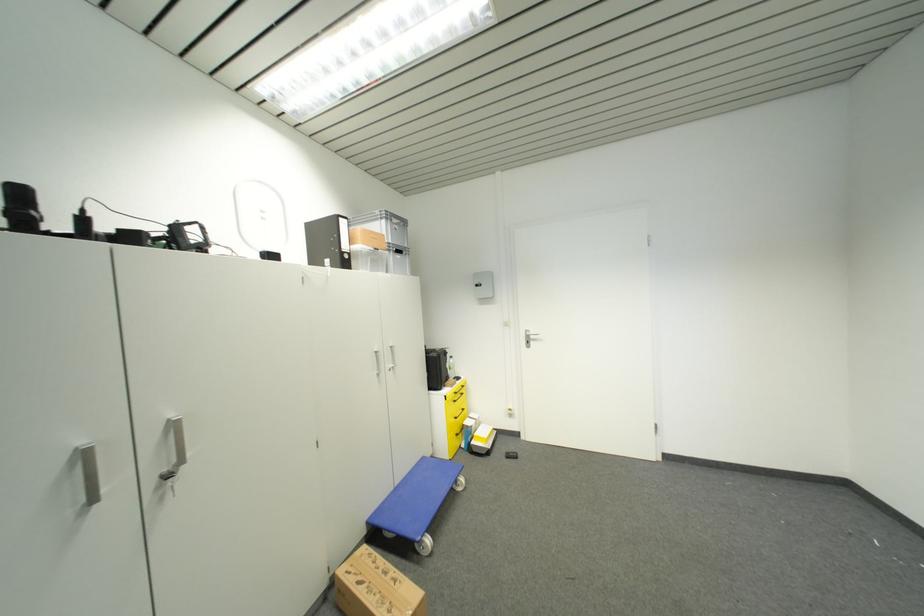
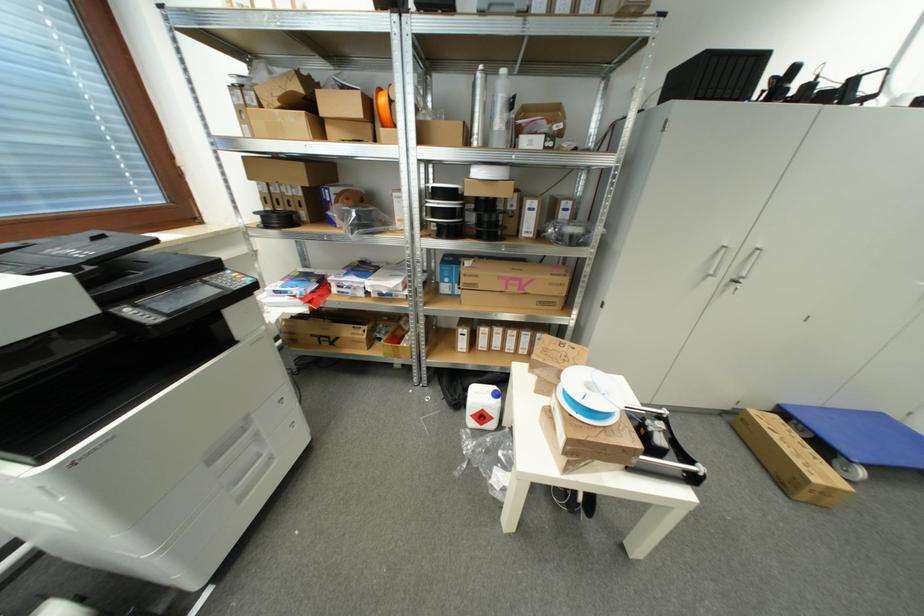
Find the pixel in the second image that matches point 369,549 in the first image.

(781, 419)